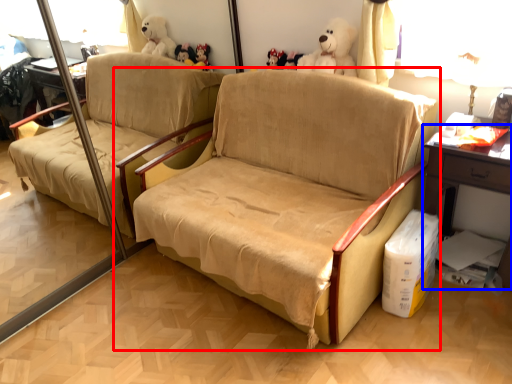
Question: Which object appears closest to the camera in this image, studio couch (highlighted by a red box) or table (highlighted by a blue box)?

Choices:
 (A) studio couch
 (B) table

Answer: (A)